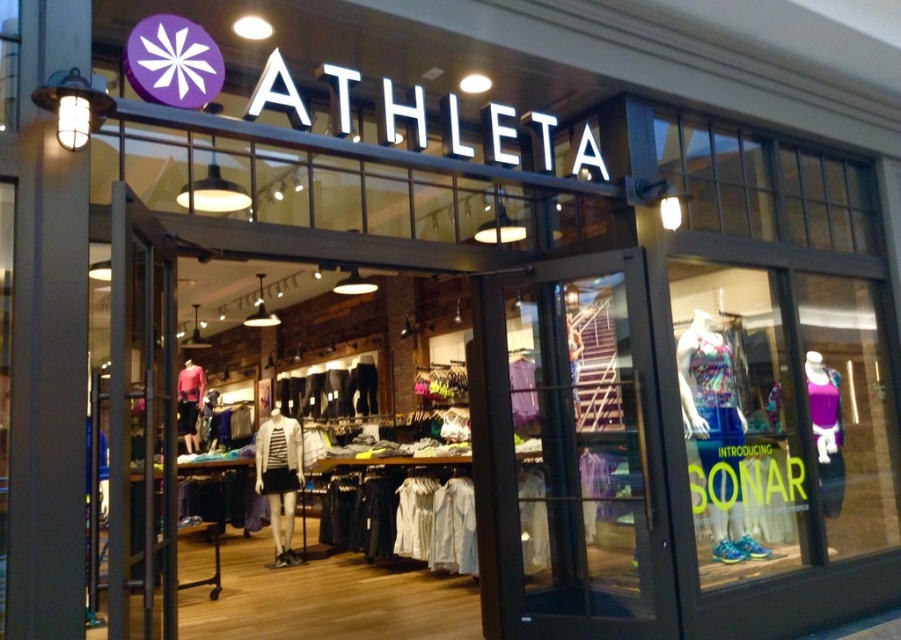
You are trying to find the shorter shirt between the white striped shirt at center and the matte red shirt at center in the Athleta store. Which one should you choose?

The white striped shirt at center has a lesser height compared to the matte red shirt at center, so you should choose the white striped shirt at center.

You are trying to decide between buying the black matte leggings at center and the purple fabric dress at center. If you want the item that takes up more space, which one should you choose?

The black matte leggings at center has a larger size compared to the purple fabric dress at center, so you should choose the black matte leggings at center.